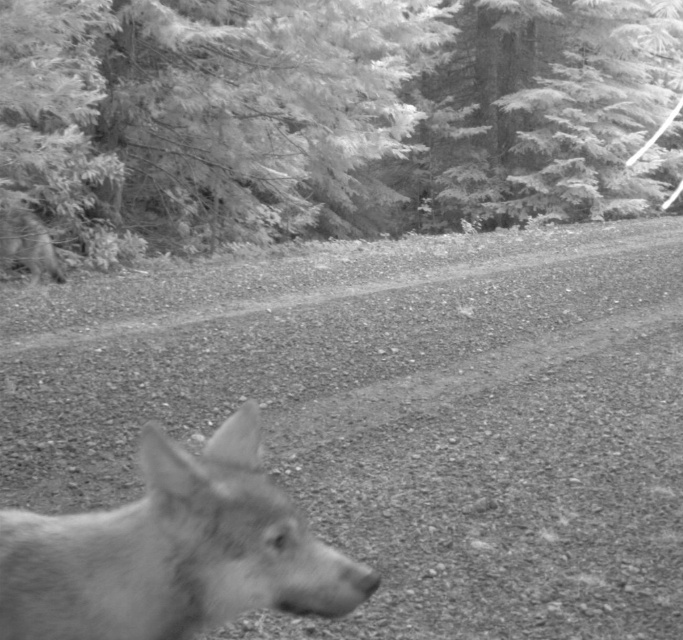
You are a photographer who wants to place a marker on the point that is closer to the camera in the image. Which point should you choose between point (585, 65) and point (117, 557)?

Point (117, 557) is closer to the camera than point (585, 65), so you should choose point (117, 557).

Based on the scene description, where is the gravelly dirt track at center located in the image?

The gravelly dirt track at center is located at point (x=398, y=416).

You are a photographer setting up a tripod to capture the wolf in motion. The gravelly dirt track at center and the coarse textured evergreen tree at upper center are in your viewfinder. Which object should you focus on to ensure sharpness if you want the background to remain in focus?

The coarse textured evergreen tree at upper center should be focused on because it is wider than the gravelly dirt track at center, making it a better reference for depth of field when keeping the background sharp.